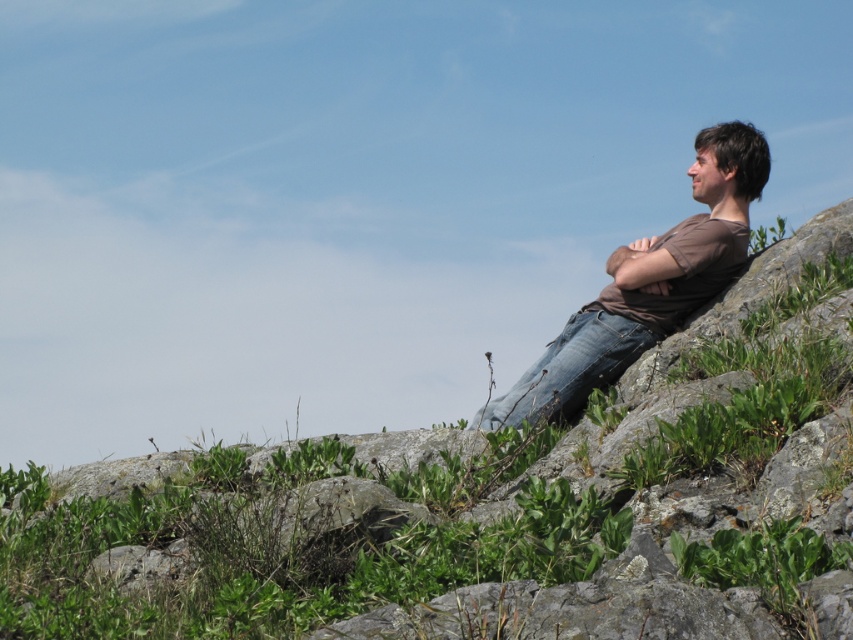
From the picture: You are a photographer standing in the scene and want to take a photo of the green grassy hillside at right and the brown cotton shirt at right. Which object should you focus on first if you want to capture both in a single shot without moving the camera?

The green grassy hillside at right is much taller than the brown cotton shirt at right, so you should focus on the green grassy hillside at right first to ensure it is in sharp focus before adjusting for the brown cotton shirt at right.

You are a photographer trying to capture the man in the image. You want to ensure that both the brown cotton shirt at right and the jeans at right are clearly visible in your shot. Given that your camera has a minimum focus distance of 10 centimeters, will you be able to focus on both items simultaneously?

The brown cotton shirt at right and jeans at right are 11.45 centimeters apart from each other. Since the minimum focus distance is 10 centimeters, the camera can focus on both items as the distance between them is greater than the minimum required.